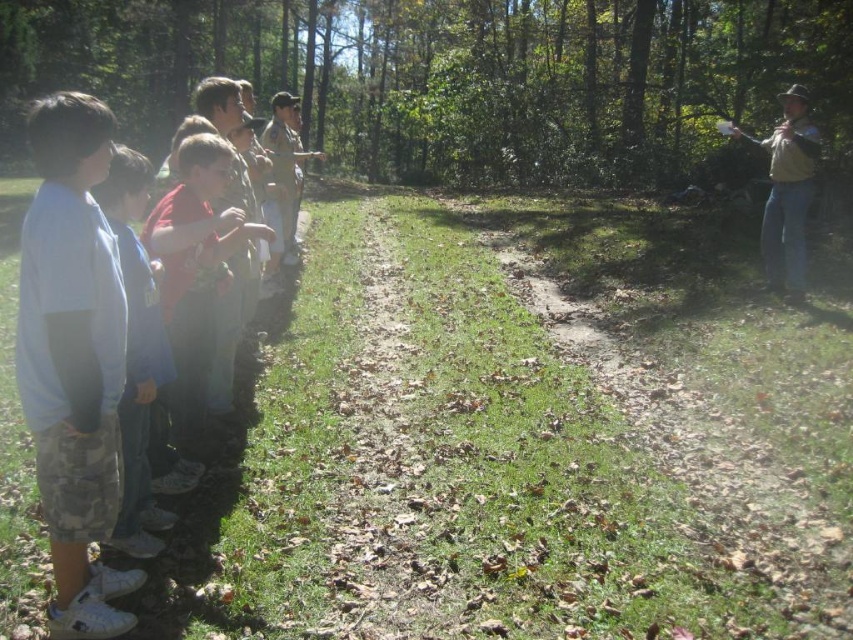
Question: Where is green leafy forest at upper center located in relation to blue denim jeans at left in the image?

Choices:
 (A) right
 (B) left

Answer: (A)

Question: Is green leafy forest at upper center further to camera compared to light blue cotton shirt at left?

Choices:
 (A) yes
 (B) no

Answer: (A)

Question: Which point appears closest to the camera in this image?

Choices:
 (A) (434, 164)
 (B) (91, 362)

Answer: (B)

Question: Among these points, which one is farthest from the camera?

Choices:
 (A) (68, 403)
 (B) (138, 275)

Answer: (B)

Question: Which object is positioned closest to the green leafy forest at upper center?

Choices:
 (A) light blue cotton shirt at left
 (B) blue denim jeans at left

Answer: (B)

Question: Is light blue cotton shirt at left positioned before blue denim jeans at left?

Choices:
 (A) yes
 (B) no

Answer: (A)